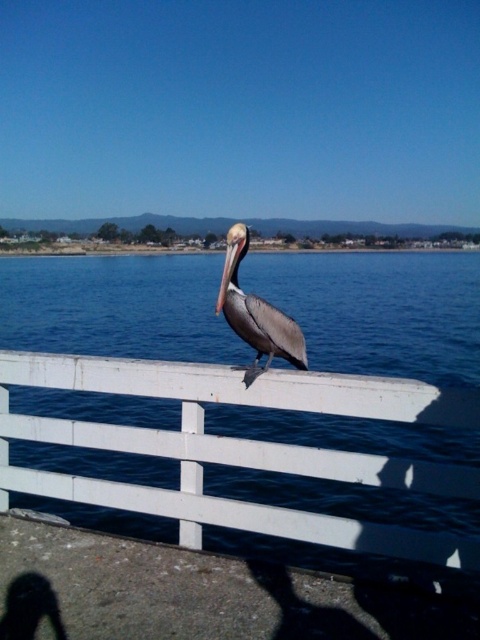
Between white painted wood at center and brown matte pelican at center, which one appears on the left side from the viewer's perspective?

Positioned to the left is white painted wood at center.

Can you confirm if white painted wood at center is wider than brown matte pelican at center?

Indeed, white painted wood at center has a greater width compared to brown matte pelican at center.

What do you see at coordinates (241, 448) in the screenshot?
I see `white painted wood at center` at bounding box center [241, 448].

The width and height of the screenshot is (480, 640). In order to click on white painted wood at center in this screenshot , I will do `click(241, 448)`.